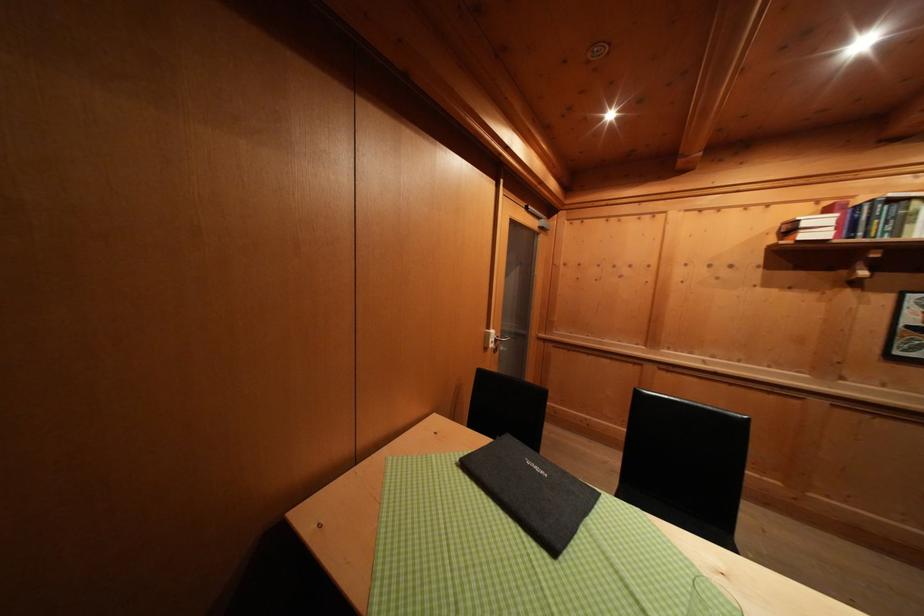
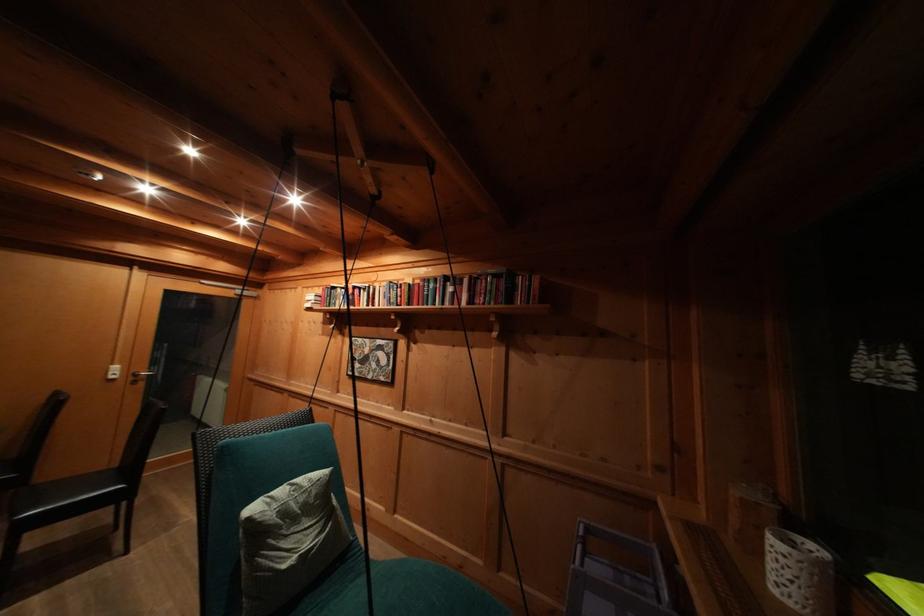
The images are taken continuously from a first-person perspective. In which direction are you moving?

The cameraman moved toward right, backward.